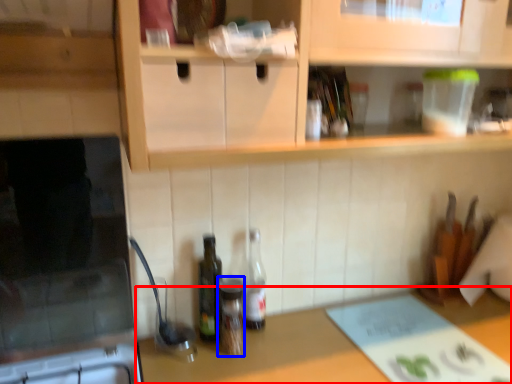
Question: Which of the following is the closest to the observer, countertop (highlighted by a red box) or bottle (highlighted by a blue box)?

Choices:
 (A) countertop
 (B) bottle

Answer: (A)